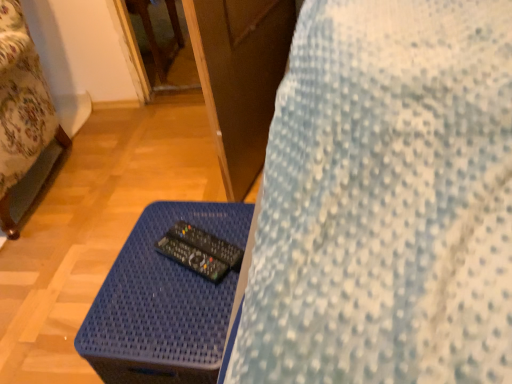
You are a GUI agent. You are given a task and a screenshot of the screen. Output one action in this format:
    pyautogui.click(x=<x>, y=<y>)
    Task: Click on the space that is in front of black plastic remote at center, arranged as the second control when viewed from the top
    This screenshot has width=512, height=384.
    Given the screenshot: What is the action you would take?
    pyautogui.click(x=173, y=314)